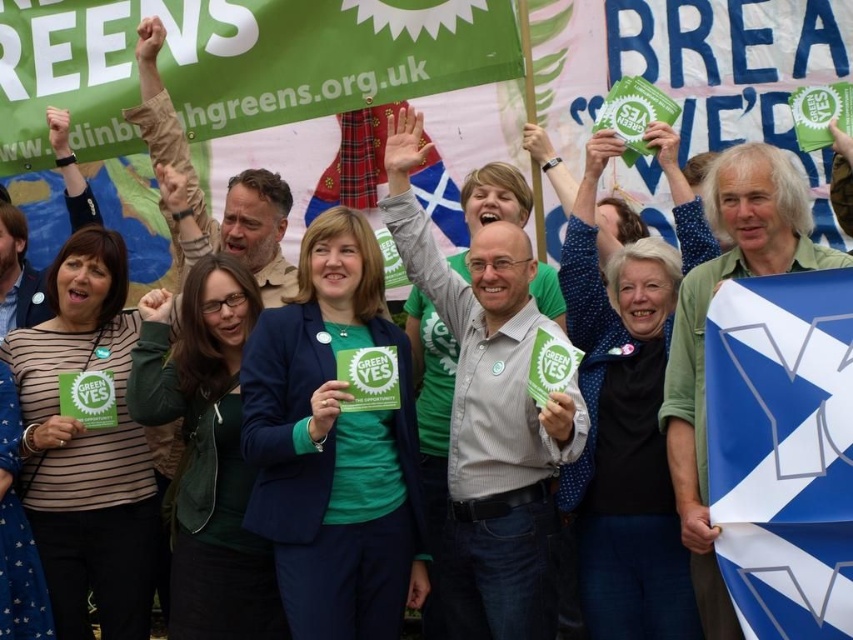
Can you confirm if green fabric banner at upper left is smaller than blue fabric flag at right?

Actually, green fabric banner at upper left might be larger than blue fabric flag at right.

Which is behind, point (329, 13) or point (740, 484)?

Positioned behind is point (329, 13).

Is point (201, 120) positioned after point (740, 301)?

Yes, it is.

Locate an element on the screen. The width and height of the screenshot is (853, 640). green fabric banner at upper left is located at coordinates (235, 61).